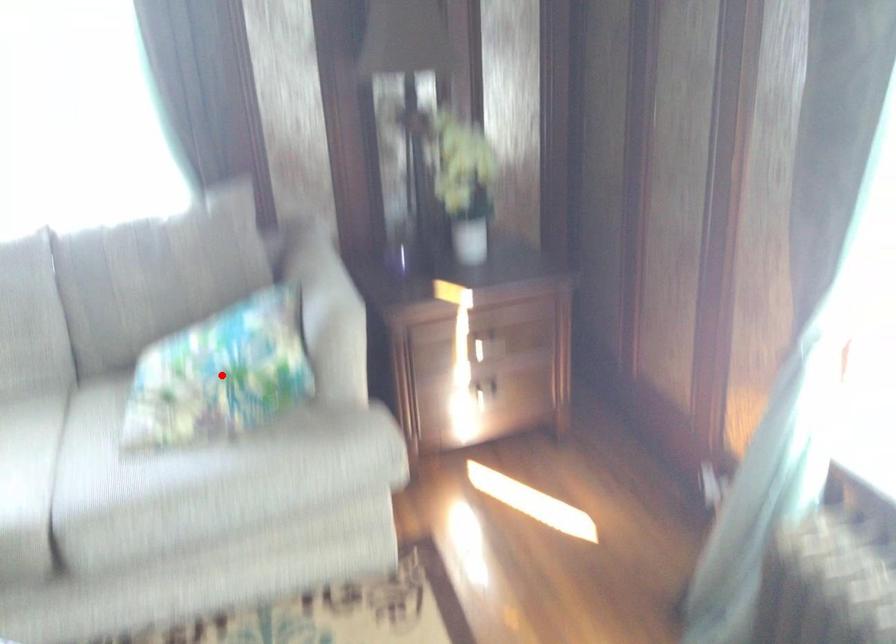
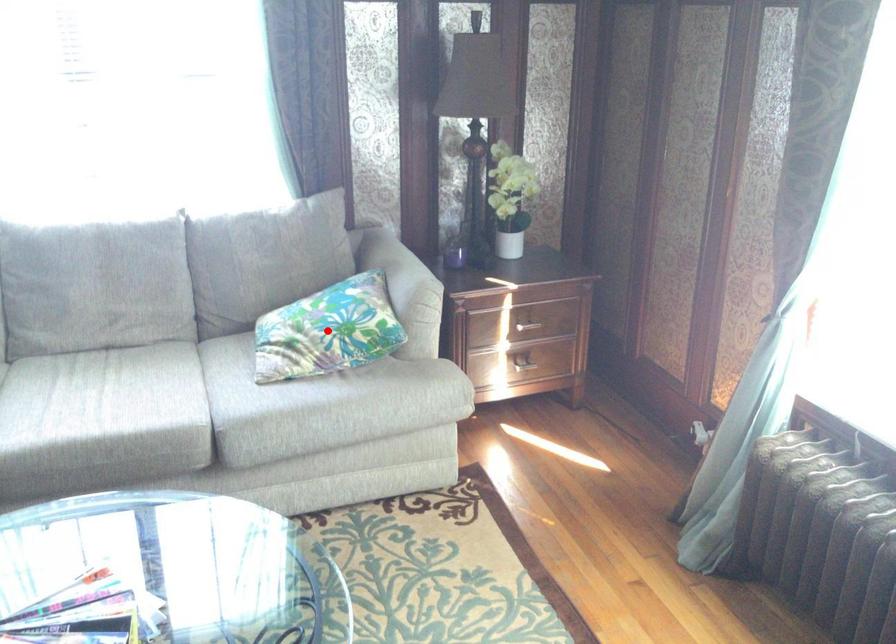
I am providing you with two images of the same scene from different viewpoints. A red point is marked on the first image and another point is marked on the second image. Does the point marked in image1 correspond to the same location as the one in image2?

Yes